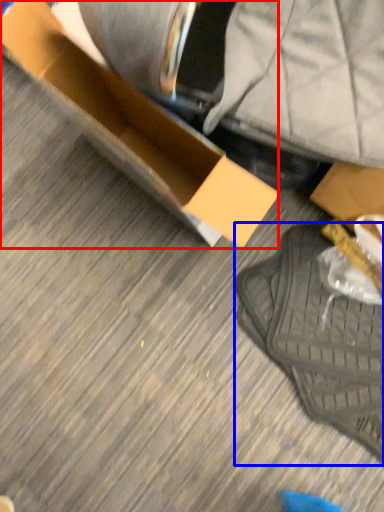
Question: Which object is further to the camera taking this photo, box (highlighted by a red box) or footwear (highlighted by a blue box)?

Choices:
 (A) box
 (B) footwear

Answer: (B)